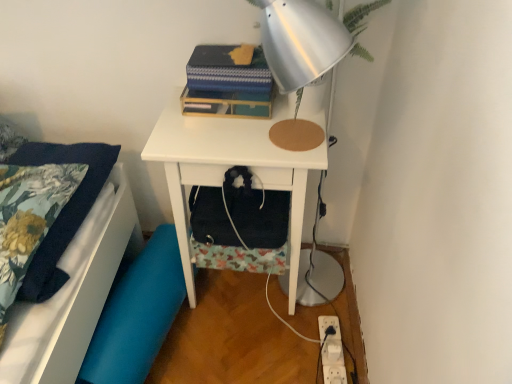
At what (x,y) coordinates should I click in order to perform the action: click on free spot in front of blue textured notebook at upper center. Please return your answer as a coordinate pair (x, y). Looking at the image, I should click on (218, 135).